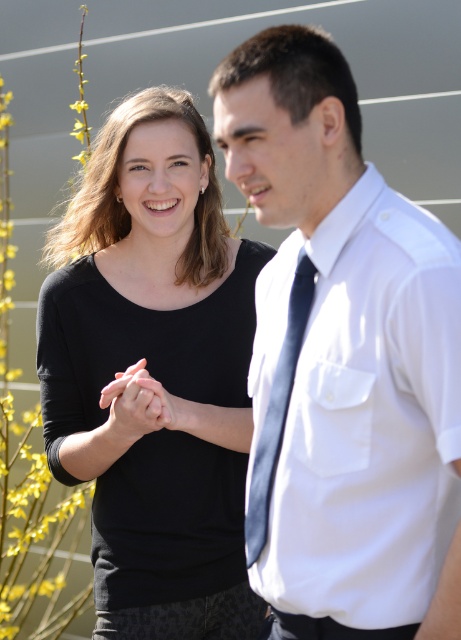
You are standing in front of a wall with a plant on the left side. You see a black matte shirt at center. If you want to reach the shirt, how many steps do you need to take forward?

The black matte shirt at center is 2.38 meters away from you. Assuming an average step length of about 0.75 meters, you would need to take approximately 3 steps forward to reach it.

Please look at the scene where a woman in a black long sleeve top and a man in a white short sleeve shirt with a dark tie are standing outdoors near a light wall with horizontal lines. There is also a plant with yellow flowers on the left. Can you tell me what object is located at the coordinate point [154,372]?

The point at coordinate [154,372] indicates the black matte shirt at center.

You are a photographer setting up a camera to capture the scene. You notice the black matte shirt at center and the dark blue silk tie at center. Which one should you focus on first if you want to ensure both are in focus, considering their positions?

The black matte shirt at center is above the dark blue silk tie at center, so focusing on the black matte shirt at center first would ensure both are in focus as the tie is positioned lower.